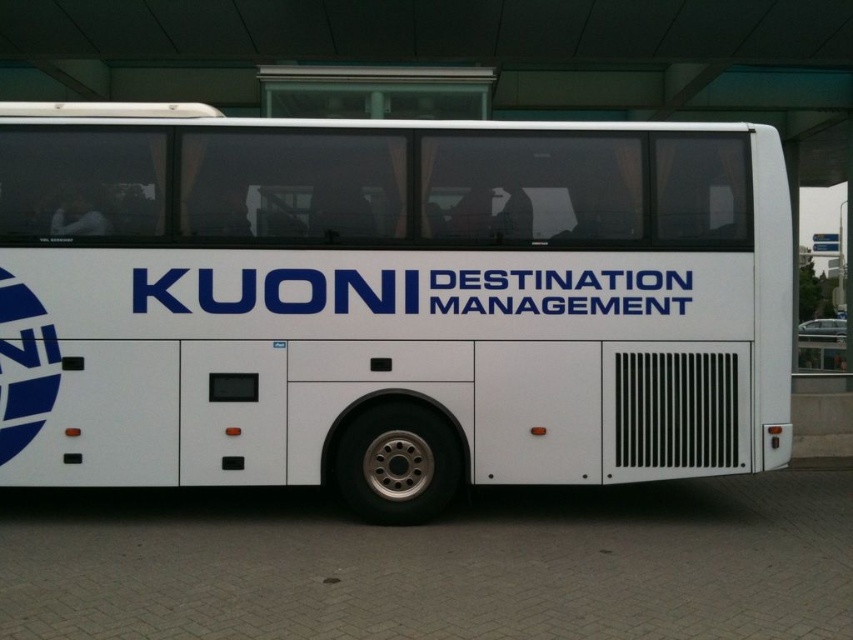
Question: Is white matte bus at center smaller than bluematerial/texturetext at center?

Choices:
 (A) yes
 (B) no

Answer: (B)

Question: Among these objects, which one is farthest from the camera?

Choices:
 (A) white matte bus at center
 (B) bluematerial/texturetext at center

Answer: (A)

Question: Where is white matte bus at center located in relation to bluematerial/texturetext at center in the image?

Choices:
 (A) above
 (B) below

Answer: (A)

Question: Can you confirm if white matte bus at center is wider than bluematerial/texturetext at center?

Choices:
 (A) yes
 (B) no

Answer: (B)